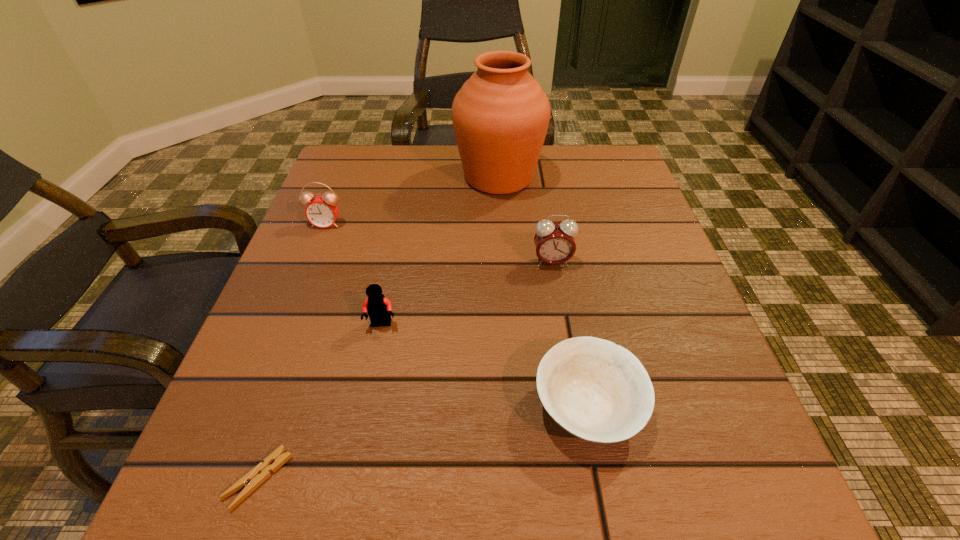
Find the location of a particular element. clothespin that is at the left edge is located at coordinates (253, 479).

Locate an element on the screen. The height and width of the screenshot is (540, 960). object that is at the right edge is located at coordinates (596, 390).

Locate an element on the screen. The height and width of the screenshot is (540, 960). object that is at the near left corner is located at coordinates (253, 479).

Where is `object that is at the near right corner`? This screenshot has height=540, width=960. object that is at the near right corner is located at coordinates (596, 390).

This screenshot has width=960, height=540. I want to click on blank area at the far edge, so click(x=406, y=152).

What are the coordinates of `free space at the near edge of the desktop` in the screenshot? It's located at (423, 485).

Where is `vacant region at the left edge of the desktop`? vacant region at the left edge of the desktop is located at coordinates (240, 446).

Where is `free location at the right edge of the desktop`? This screenshot has height=540, width=960. free location at the right edge of the desktop is located at coordinates (638, 204).

The height and width of the screenshot is (540, 960). In the image, there is a desktop. What are the coordinates of `vacant space at the far left corner` in the screenshot? It's located at (385, 184).

Where is `vacant space at the far right corner`? The height and width of the screenshot is (540, 960). vacant space at the far right corner is located at coordinates (608, 158).